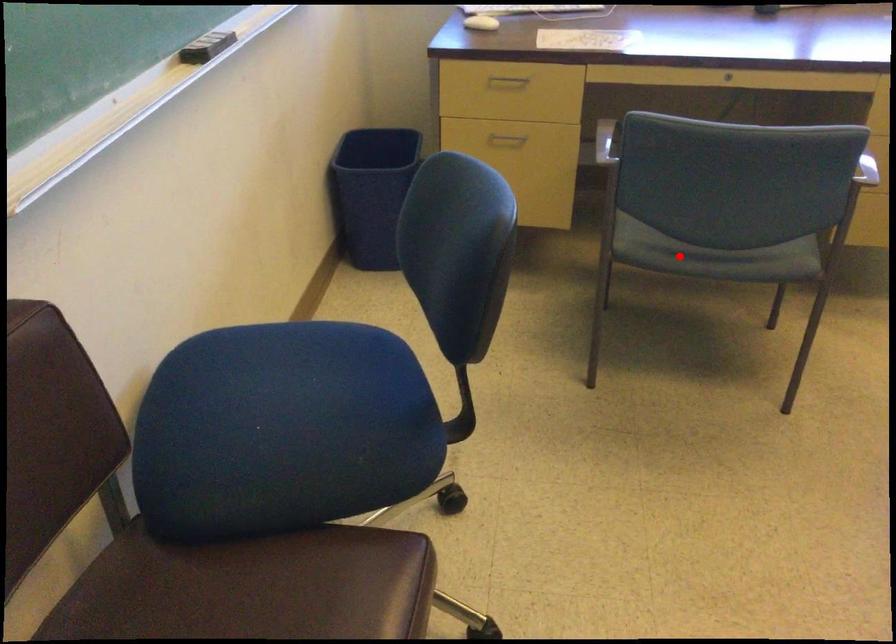
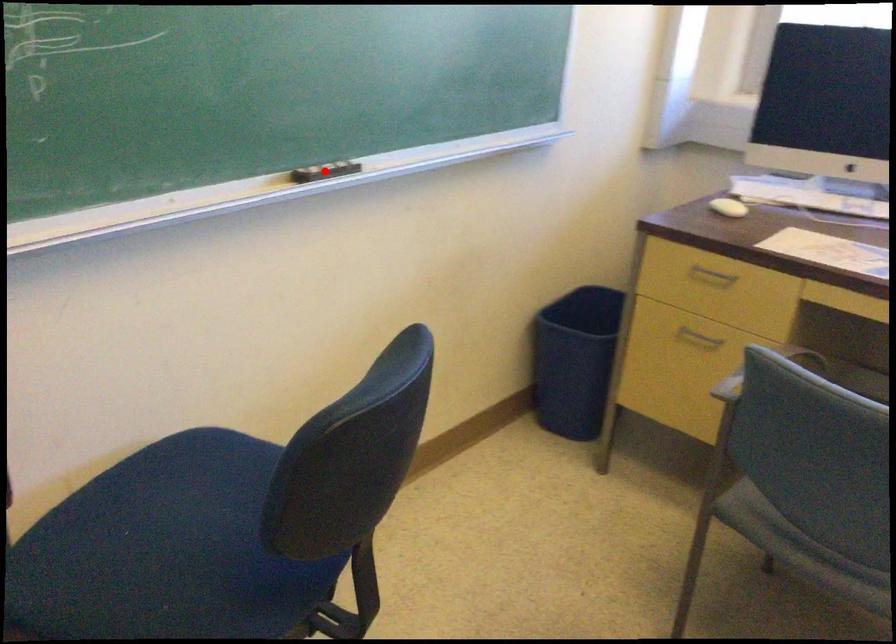
I am providing you with two images of the same scene from different viewpoints. A red point is marked on the first image and another point is marked on the second image. Does the point marked in image1 correspond to the same location as the one in image2?

No